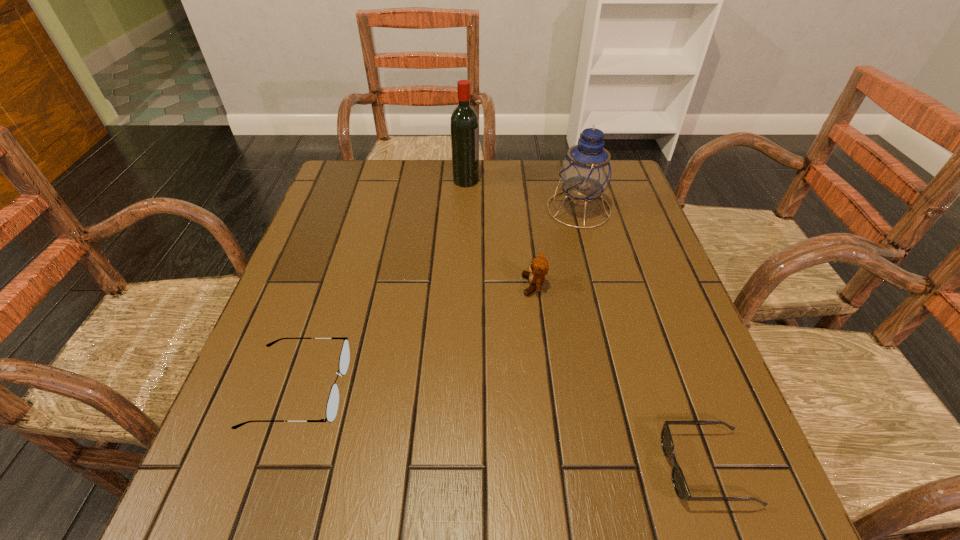
Where is `empty space between the fourth object from right to left and the shortest object`? empty space between the fourth object from right to left and the shortest object is located at coordinates (587, 324).

The image size is (960, 540). Identify the location of free space between the tallest object and the sunglasses. (587, 324).

Where is `vacant space that is in between the leftmost object and the tallest object`? The width and height of the screenshot is (960, 540). vacant space that is in between the leftmost object and the tallest object is located at coordinates click(382, 285).

Locate an element on the screen. Image resolution: width=960 pixels, height=540 pixels. free space between the second tallest object and the tallest object is located at coordinates (522, 194).

Identify the location of empty space between the spectacles and the lantern. (439, 299).

Select which object appears as the closest to the fourth tallest object. Please provide its 2D coordinates. Your answer should be formatted as a tuple, i.e. [(x, y)], where the tuple contains the x and y coordinates of a point satisfying the conditions above.

[(539, 267)]

Point out which object is positioned as the nearest to the farthest object. Please provide its 2D coordinates. Your answer should be formatted as a tuple, i.e. [(x, y)], where the tuple contains the x and y coordinates of a point satisfying the conditions above.

[(585, 173)]